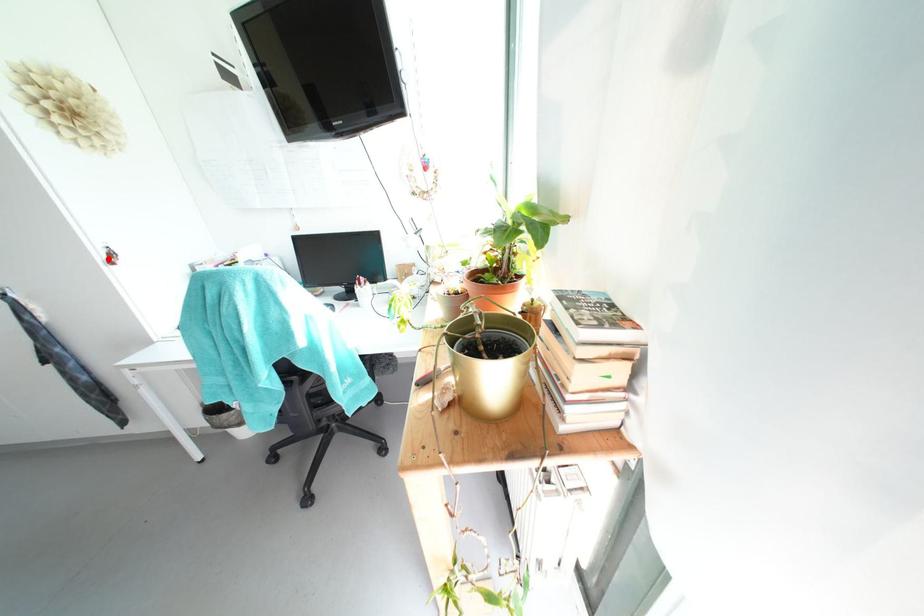
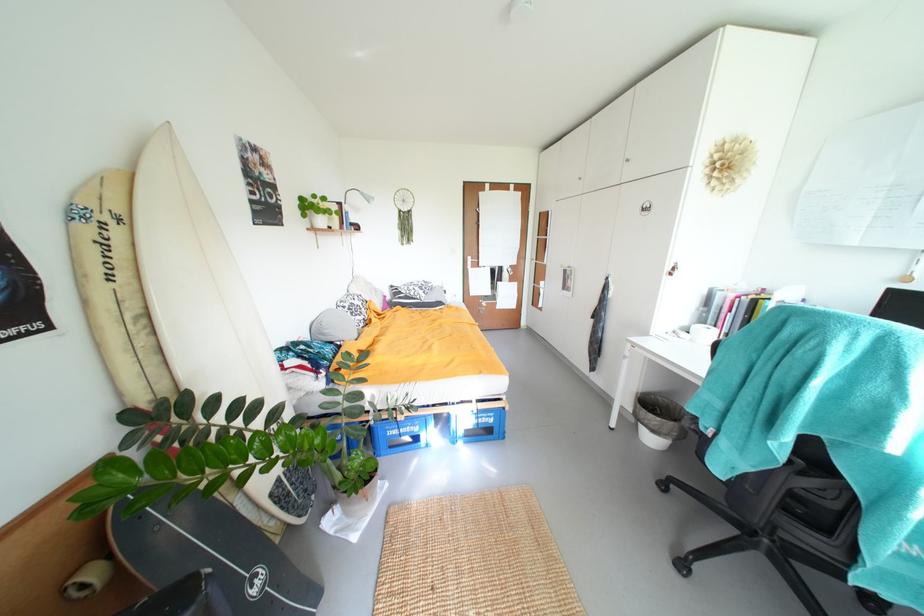
The point at the highlighted location is marked in the first image. Where is the corresponding point in the second image?

(675, 270)